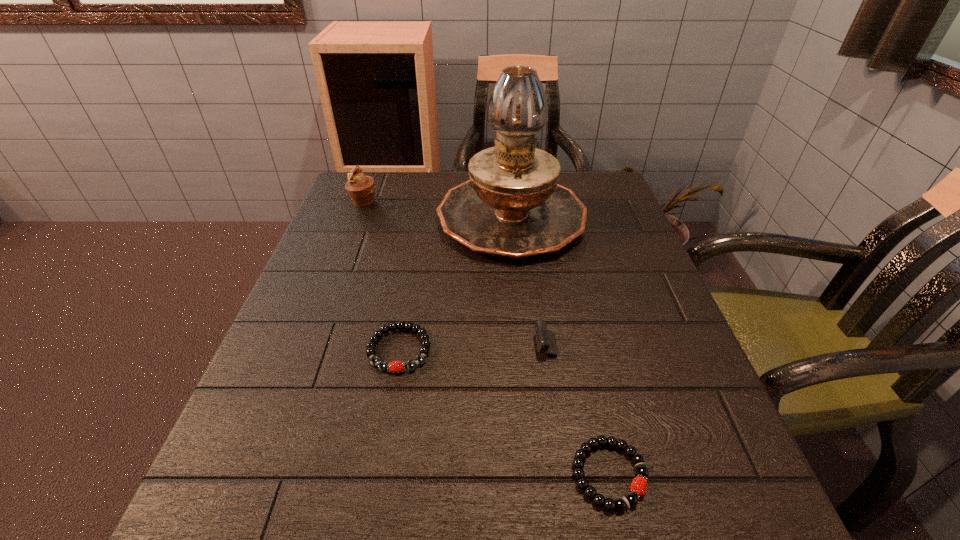
The height and width of the screenshot is (540, 960). I want to click on bracelet situated at the right edge, so (x=620, y=504).

You are a GUI agent. You are given a task and a screenshot of the screen. Output one action in this format:
    pyautogui.click(x=<x>, y=<y>)
    Task: Click on the object present at the far left corner
    This screenshot has width=960, height=540.
    Given the screenshot: What is the action you would take?
    pyautogui.click(x=361, y=189)

I want to click on object that is at the far right corner, so click(512, 207).

Locate an element on the screen. object present at the near right corner is located at coordinates (620, 504).

Identify the location of vacant position at the far edge of the desktop. pyautogui.click(x=453, y=178).

Image resolution: width=960 pixels, height=540 pixels. Find the location of `vacant space at the near edge`. vacant space at the near edge is located at coordinates (523, 505).

Find the location of `vacant area at the left edge of the desktop`. vacant area at the left edge of the desktop is located at coordinates (317, 310).

Where is `vacant space at the right edge`? vacant space at the right edge is located at coordinates (667, 314).

The image size is (960, 540). I want to click on blank space at the far right corner of the desktop, so (x=601, y=178).

This screenshot has height=540, width=960. I want to click on free spot at the near right corner of the desktop, so click(x=746, y=500).